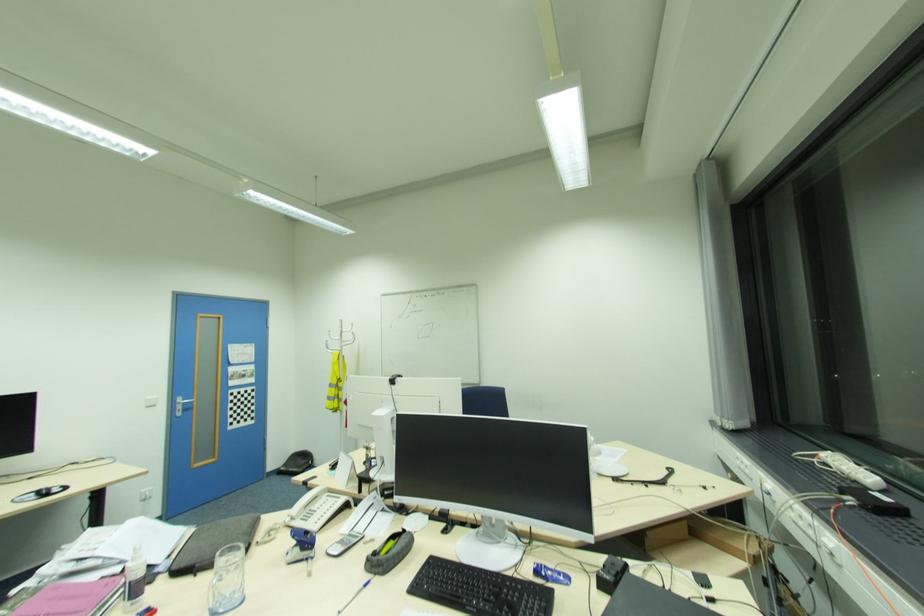
At what (x,y) coordinates should I click in order to perform the action: click on blue tape dispenser. Please return your answer as a coordinate pair (x, y). The height and width of the screenshot is (616, 924). Looking at the image, I should click on (300, 546).